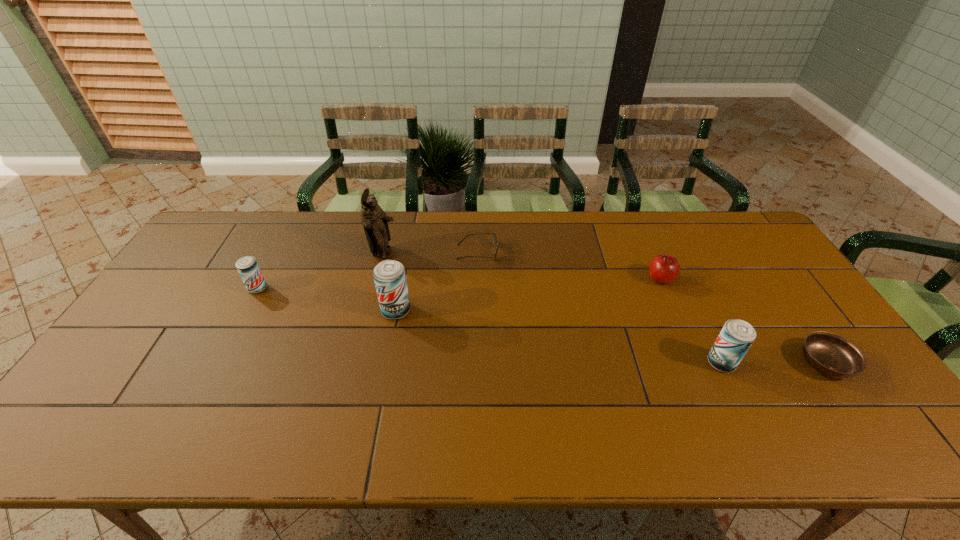
If the aim is uniform spacing by inserting an additional beer_can among them, please point to a vacant space for this new beer_can. Please provide its 2D coordinates. Your answer should be formatted as a tuple, i.e. [(x, y)], where the tuple contains the x and y coordinates of a point satisfying the conditions above.

[(549, 335)]